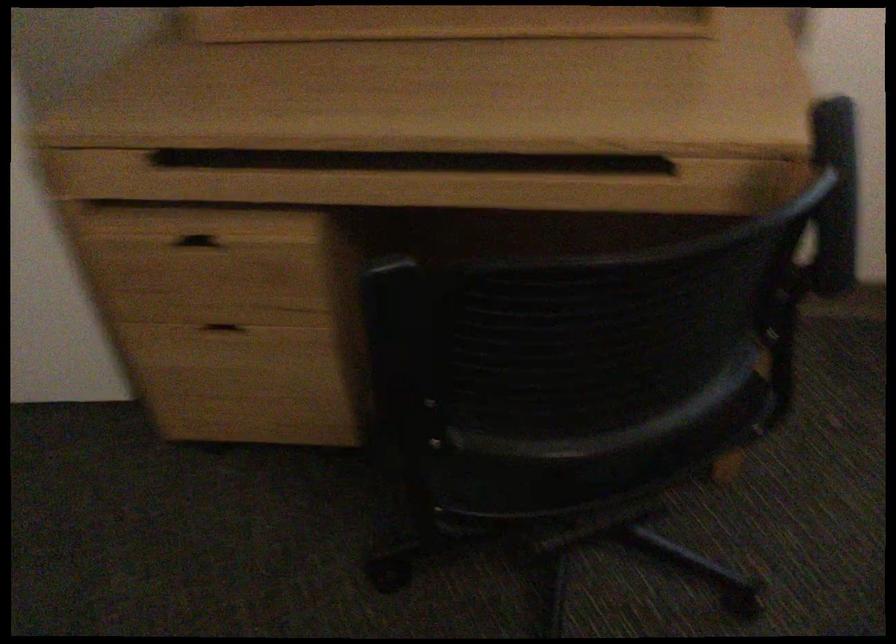
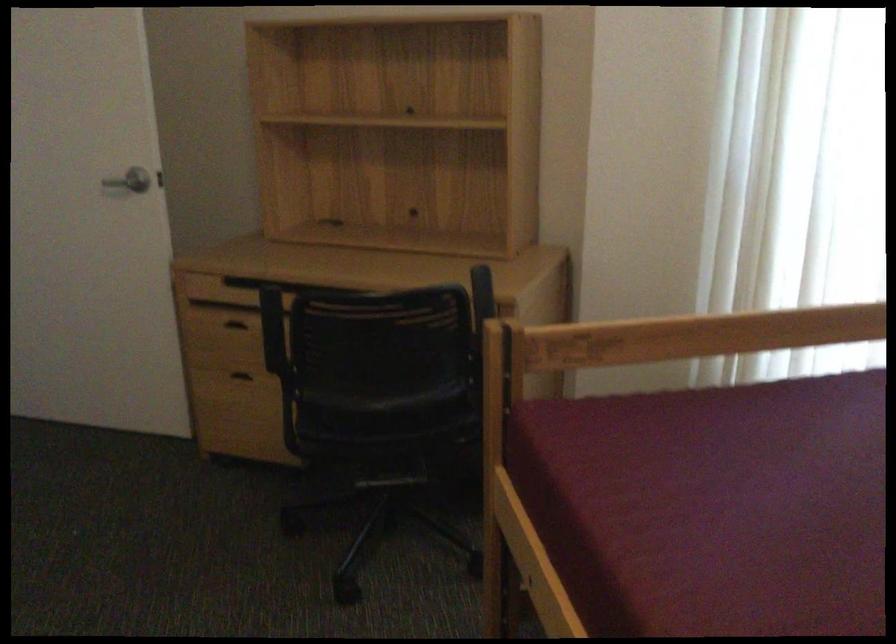
Locate, in the second image, the point that corresponds to (x=625, y=410) in the first image.

(383, 391)